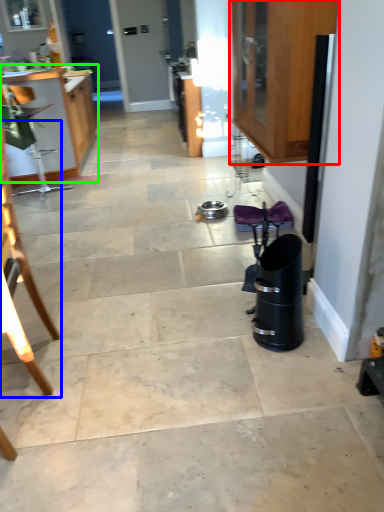
Question: Which object is positioned farthest from cabinetry (highlighted by a red box)? Select from chair (highlighted by a blue box) and cabinetry (highlighted by a green box).

Choices:
 (A) chair
 (B) cabinetry

Answer: (B)